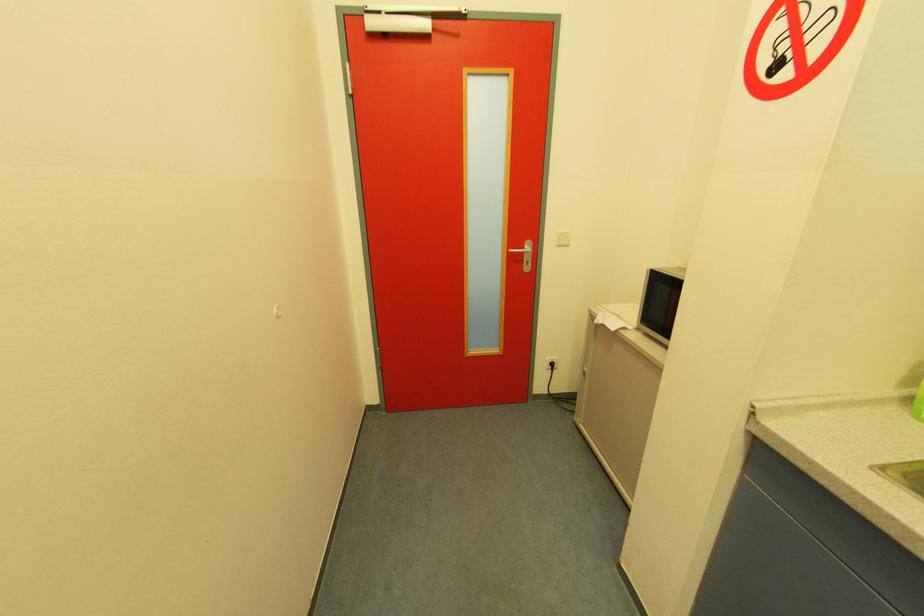
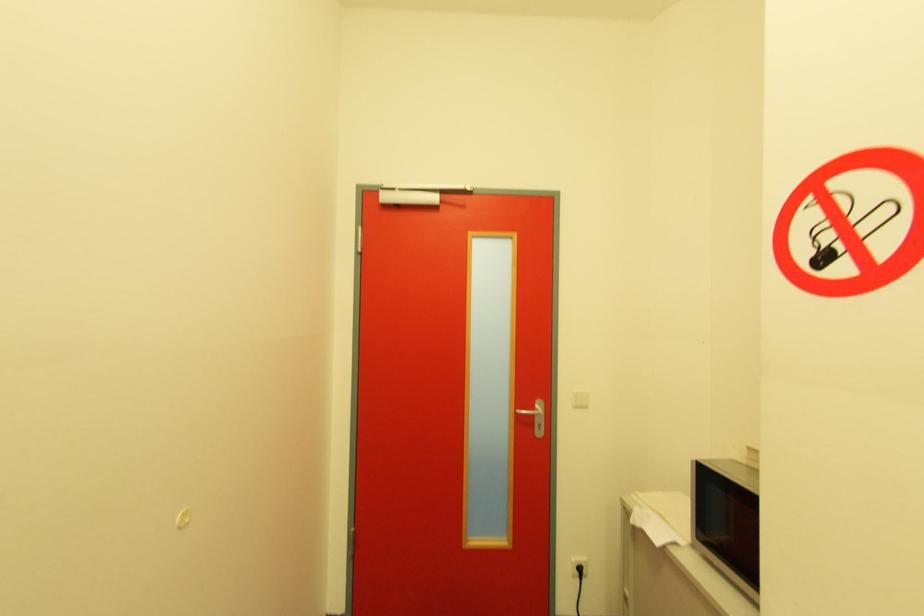
Question: The images are taken continuously from a first-person perspective. In which direction is your viewpoint rotating?

Choices:
 (A) Left
 (B) Right
 (C) Up
 (D) Down

Answer: (C)